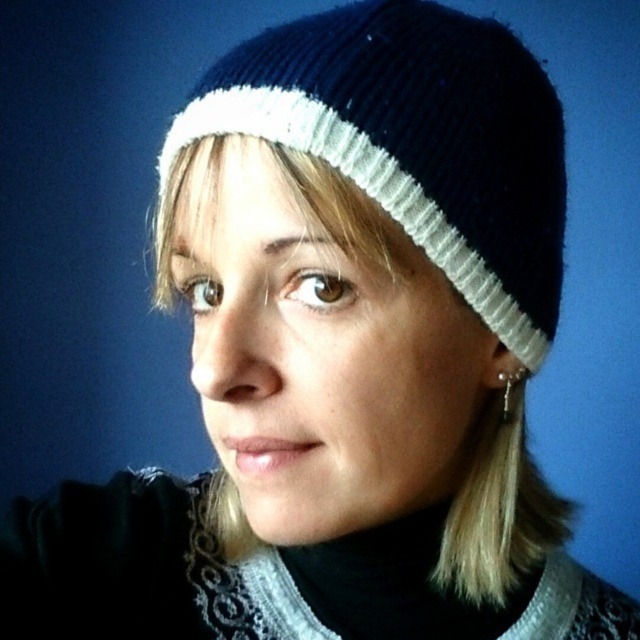
You are taking a photo of a person wearing a dark blue knit beanie and a black turtleneck sweater. There are two points marked on the image at coordinates point [317,83] and point [502,394]. From the photographer perspective, which point is closer to the camera?

Result: Point [317,83] is in front of point [502,394], so it is closer to the camera.

You are a photographer using a camera that requires a minimum distance of 12 inches to focus properly. You are taking a portrait of a person wearing a navy blue knitted hat at center. Based on the scene, will the camera be able to focus on the hat?

The navy blue knitted hat at center and camera are 13.98 inches apart, which is greater than the minimum required distance of 12 inches. Therefore, the camera will be able to focus on the hat.

You are a photographer setting up for a portrait shoot. The subject is wearing a navy blue knitted hat at center and a silver metallic earring at lower right. You need to position a spotlight so it can evenly illuminate both items without creating harsh shadows. Given that the distance between them is 4.90 inches, what is the minimum diameter the spotlight should have to cover both objects?

The navy blue knitted hat at center and silver metallic earring at lower right are 4.90 inches apart. To ensure both are evenly illuminated, the spotlight should have a minimum diameter of at least 4.90 inches so that its coverage area can encompass both objects without leaving any shadowed regions between them.